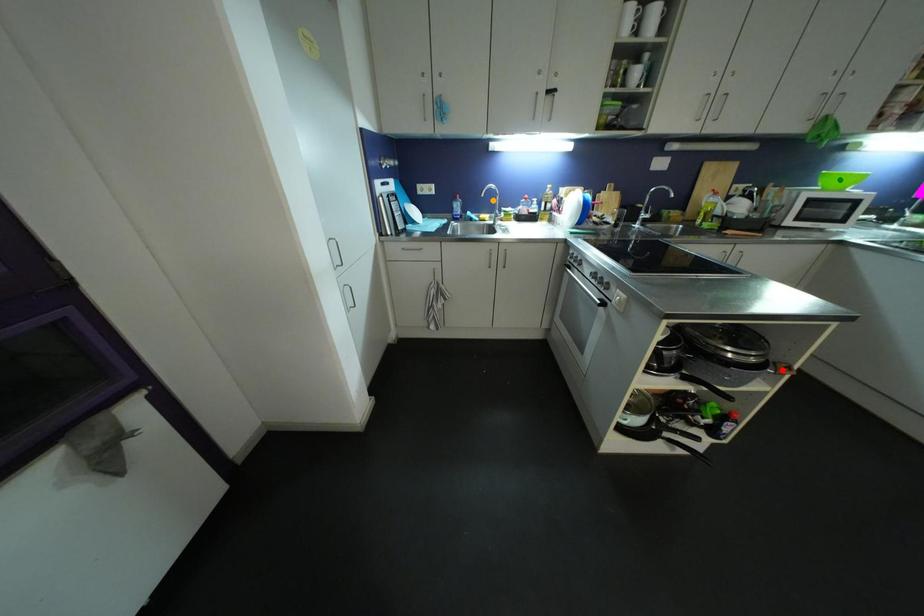
Order these from nearest to farthest:
red point
green point
orange point

1. red point
2. green point
3. orange point